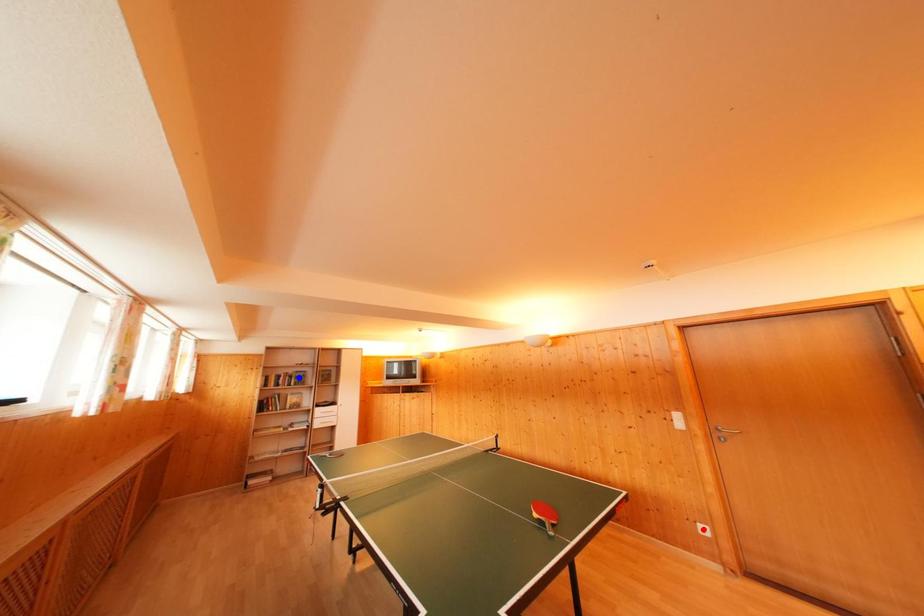
Question: Two points are marked on the image. Which point is closer to the camera?

Choices:
 (A) Blue point is closer.
 (B) Red point is closer.

Answer: (B)